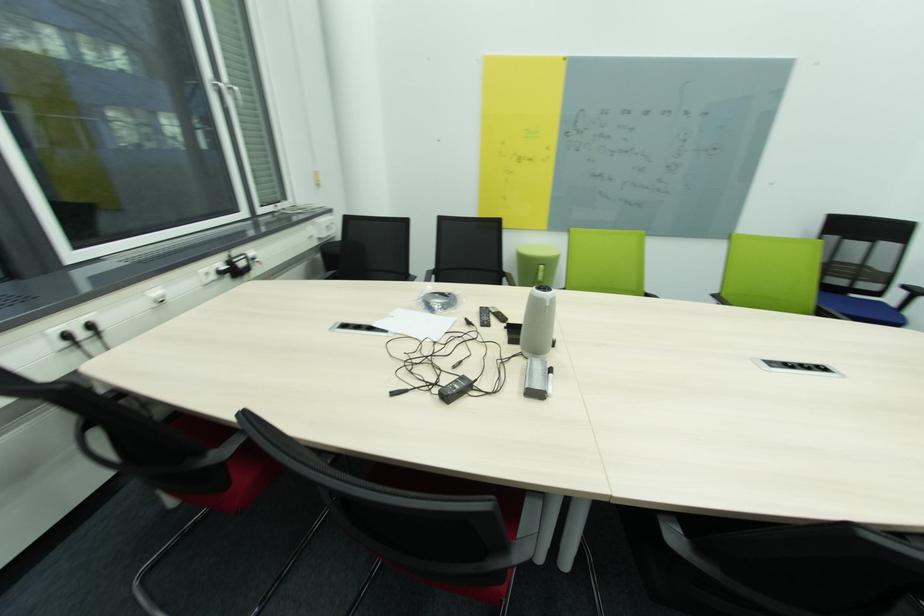
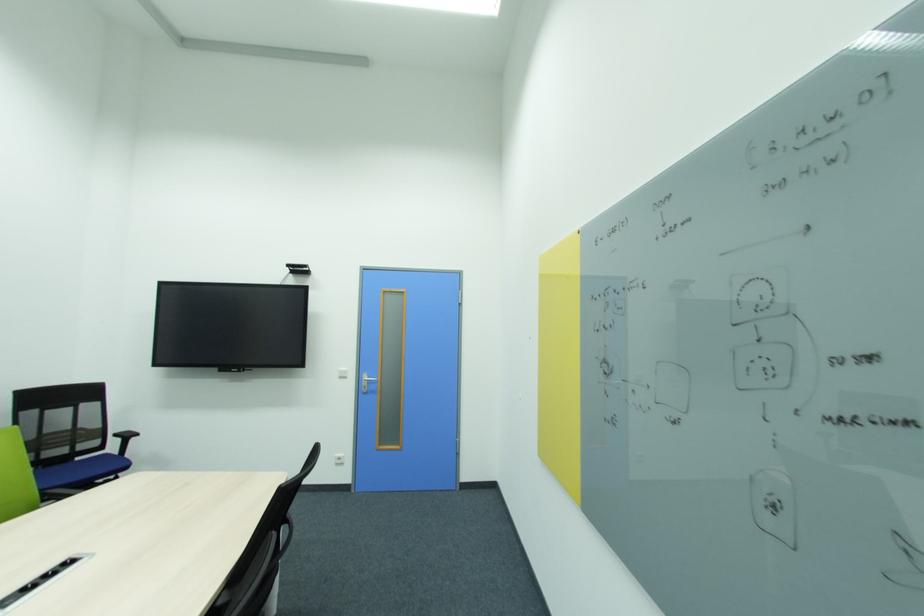
Question: Based on the continuous images, in which direction is the camera rotating? Reply with the corresponding letter.

Choices:
 (A) Left
 (B) Right
 (C) Up
 (D) Down

Answer: (B)